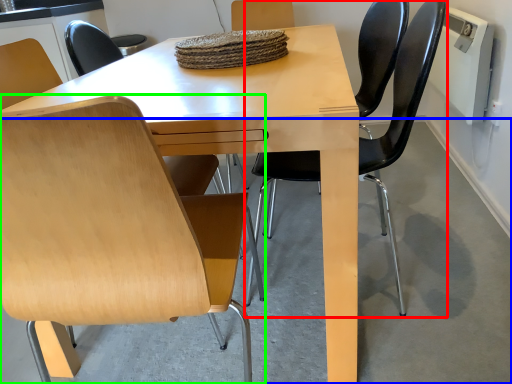
Question: Which object is positioned closest to chair (highlighted by a red box)? Select from concrete (highlighted by a blue box) and chair (highlighted by a green box).

Choices:
 (A) concrete
 (B) chair

Answer: (A)